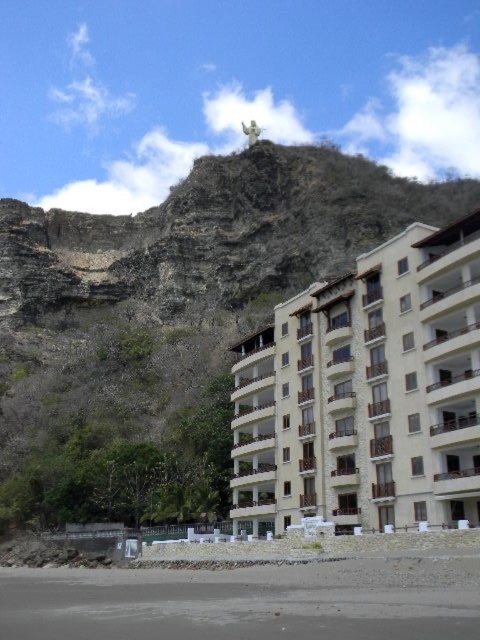
Question: Can you confirm if brown rocky mountain at upper center is thinner than beige stone building at center?

Choices:
 (A) no
 (B) yes

Answer: (A)

Question: Which point is closer to the camera?

Choices:
 (A) brown rocky mountain at upper center
 (B) beige stone building at center

Answer: (B)

Question: Can you confirm if brown rocky mountain at upper center is positioned above beige stone building at center?

Choices:
 (A) yes
 (B) no

Answer: (A)

Question: Which point is farther from the camera taking this photo?

Choices:
 (A) (431, 336)
 (B) (120, 305)

Answer: (B)

Question: Among these objects, which one is farthest from the camera?

Choices:
 (A) brown rocky mountain at upper center
 (B) beige stone building at center

Answer: (A)

Question: Is brown rocky mountain at upper center in front of beige stone building at center?

Choices:
 (A) no
 (B) yes

Answer: (A)